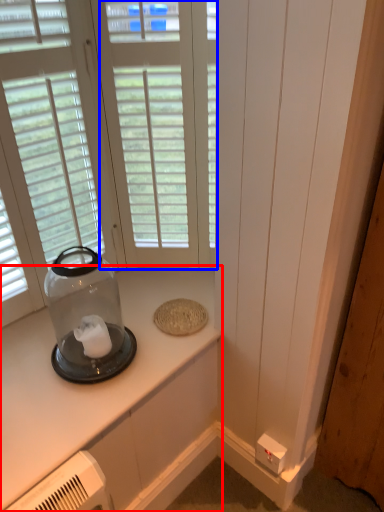
Question: Which of the following is the farthest to the observer, countertop (highlighted by a red box) or window (highlighted by a blue box)?

Choices:
 (A) countertop
 (B) window

Answer: (B)